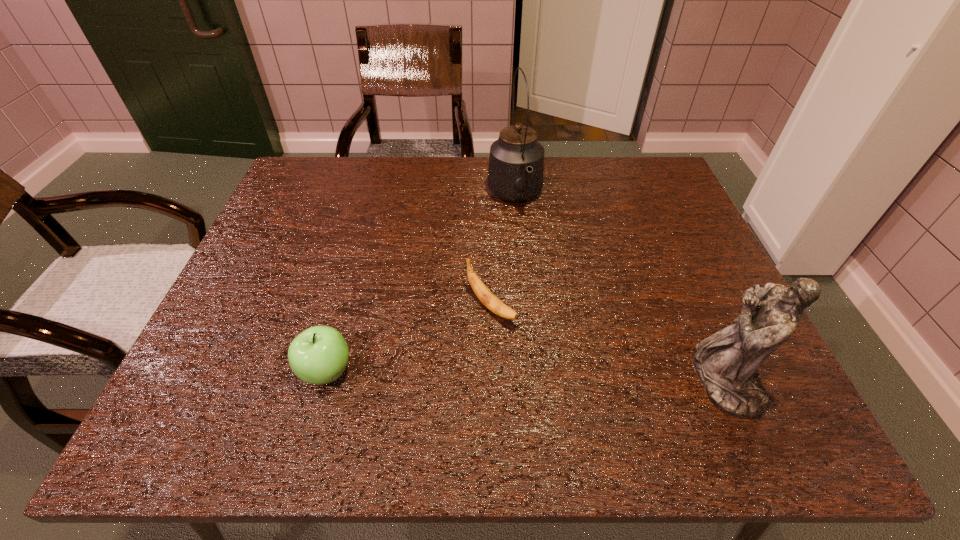
I want to click on free spot located 0.270m on the front-facing side of the third shortest object, so click(555, 380).

This screenshot has height=540, width=960. In order to click on vacant space located 0.380m on the front-facing side of the third shortest object in this screenshot , I will do pyautogui.click(x=497, y=380).

The height and width of the screenshot is (540, 960). I want to click on free space located 0.050m spout on the farthest object, so click(526, 233).

At what (x,y) coordinates should I click in order to perform the action: click on vacant area located spout on the farthest object. Please return your answer as a coordinate pair (x, y). This screenshot has width=960, height=540. Looking at the image, I should click on [548, 293].

Where is `free spot located 0.310m spout on the farthest object`? This screenshot has height=540, width=960. free spot located 0.310m spout on the farthest object is located at coordinates (554, 309).

Locate an element on the screen. The image size is (960, 540). blank space located 0.130m on the peel of the banana from the top is located at coordinates (551, 367).

This screenshot has width=960, height=540. In order to click on vacant space located on the peel of the banana from the top in this screenshot , I will do pos(555,370).

Identify the location of vacant region located 0.080m on the peel of the banana from the top. (534, 350).

I want to click on object that is at the far edge, so click(516, 163).

What are the coordinates of `apple present at the near edge` in the screenshot? It's located at (319, 355).